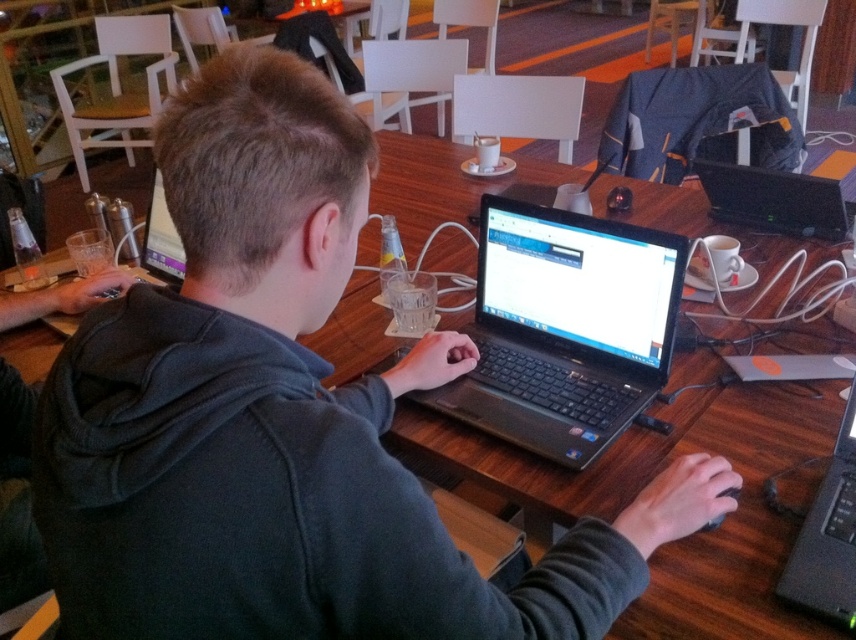
Question: Can you confirm if black matte laptop at center is positioned above black plastic laptop at center?

Choices:
 (A) yes
 (B) no

Answer: (A)

Question: Is black plastic laptop at center closer to the viewer compared to black plastic laptop at upper right?

Choices:
 (A) yes
 (B) no

Answer: (A)

Question: Among these points, which one is nearest to the camera?

Choices:
 (A) (770, 225)
 (B) (447, 400)

Answer: (B)

Question: Which of the following is the farthest from the observer?

Choices:
 (A) (841, 540)
 (B) (506, 234)
 (C) (753, 212)

Answer: (C)

Question: Which object is positioned closest to the black plastic laptop at center?

Choices:
 (A) black matte laptop at center
 (B) black plastic laptop at upper right

Answer: (A)

Question: Is black plastic laptop at center to the left of black plastic laptop at upper right from the viewer's perspective?

Choices:
 (A) yes
 (B) no

Answer: (A)